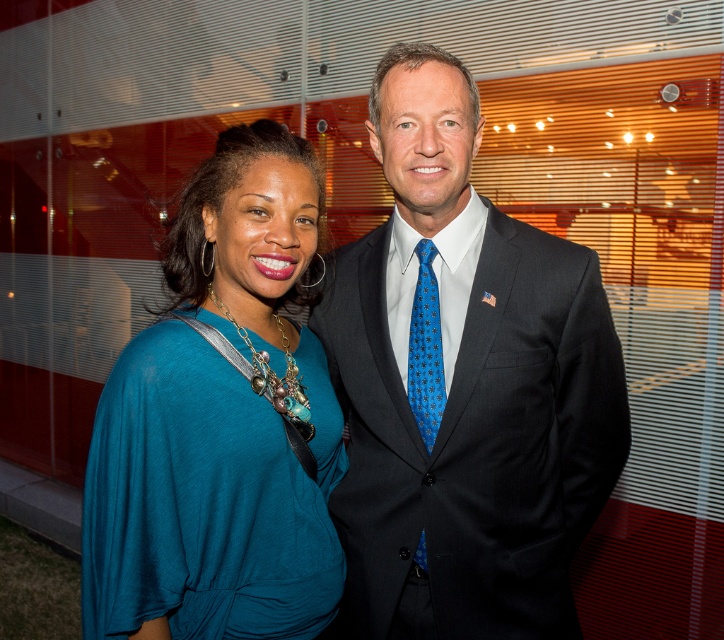
Question: Can you confirm if dark gray suit at center is positioned below teal fabric dress at center?

Choices:
 (A) yes
 (B) no

Answer: (B)

Question: Which point is closer to the camera taking this photo?

Choices:
 (A) (421, 291)
 (B) (494, 628)

Answer: (B)

Question: Which point appears closest to the camera in this image?

Choices:
 (A) (413, 227)
 (B) (164, 572)

Answer: (B)

Question: Can you confirm if dark gray suit at center is positioned above teal fabric dress at center?

Choices:
 (A) no
 (B) yes

Answer: (B)

Question: Does teal fabric dress at center have a smaller size compared to blue silk tie at center?

Choices:
 (A) yes
 (B) no

Answer: (B)

Question: Which point is farther to the camera?

Choices:
 (A) dark gray suit at center
 (B) teal fabric dress at center
 (C) blue silk tie at center

Answer: (C)